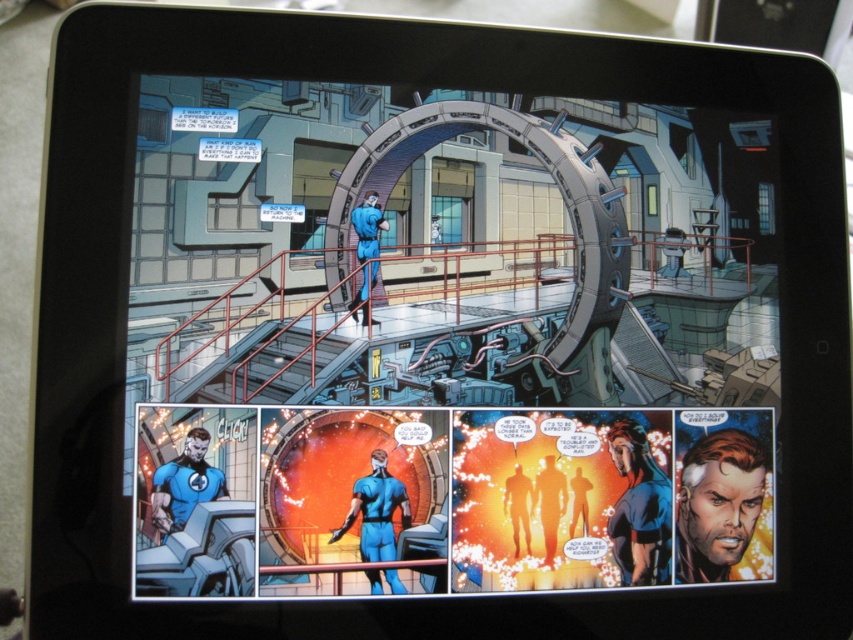
You are an artist reviewing a comic book page on a tablet. You notice two versions of the main character wearing different suits. The first is a blue glossy suit at center, and the second is a matte blue suit at bottom left. Which version of the suit appears to be wider?

The blue glossy suit at center appears wider because its width is larger than the matte blue suit at bottom left.